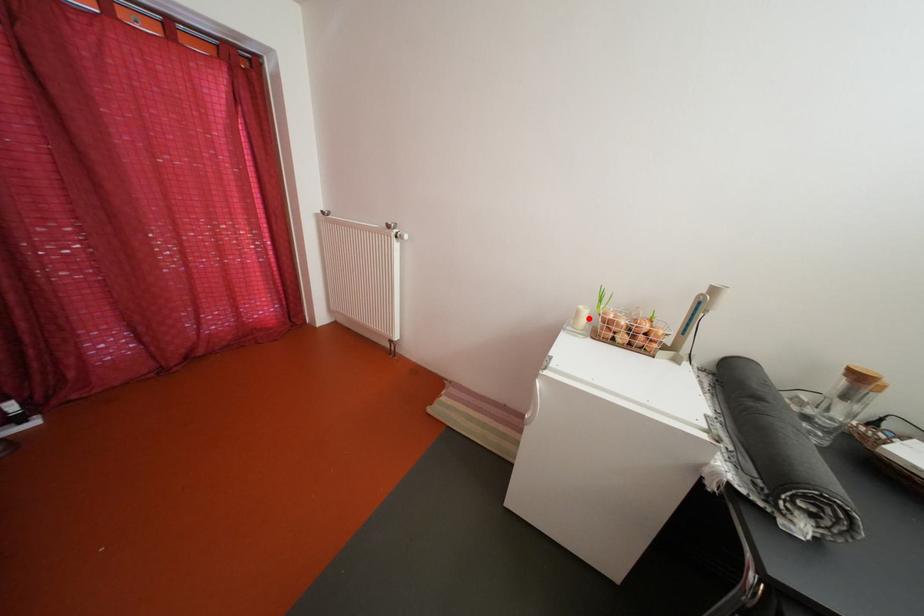
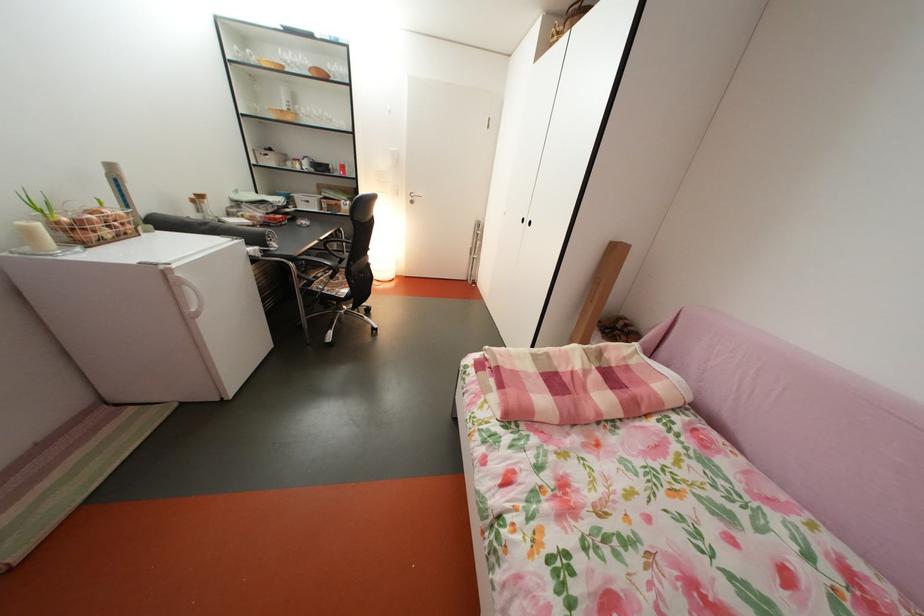
Question: I am providing you with two images of the same scene from different viewpoints. A red point is shown in image1. For the corresponding object point in image2, is it positioned nearer or farther from the camera?

Choices:
 (A) Nearer
 (B) Farther

Answer: (B)